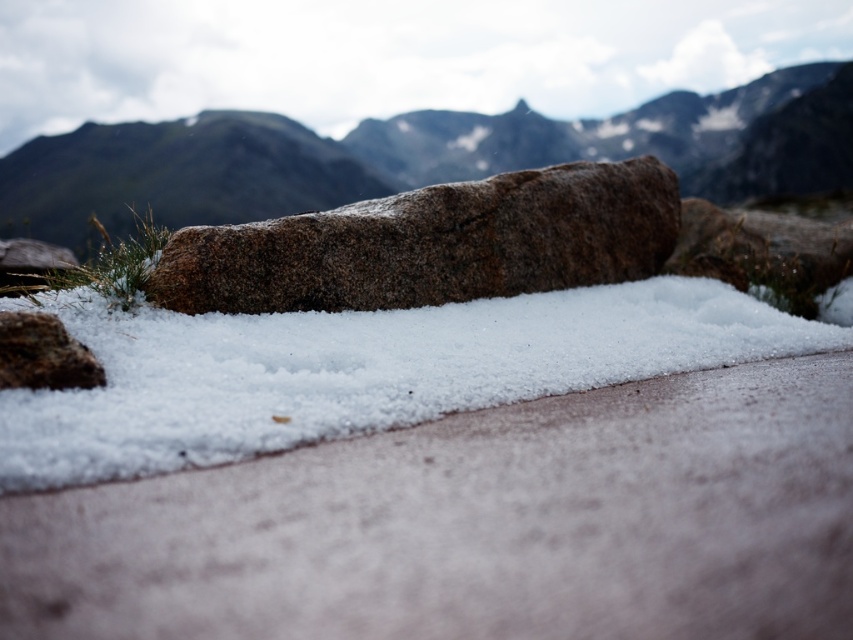
You are standing at the base of the mountain and see the white crystalline snow at center and the granite boulder at center. Which object is nearer to you?

The white crystalline snow at center is closer to the viewer than the granite boulder at center, so the white crystalline snow at center is nearer to you.

You are standing at the base of the mountain in the image. You see two points marked on the snow. The first point is at coordinate point [645,124] and the second is at point [329,244]. Which point is closer to you?

Point [645,124] is closer to you because it is further to the viewer than point [329,244].